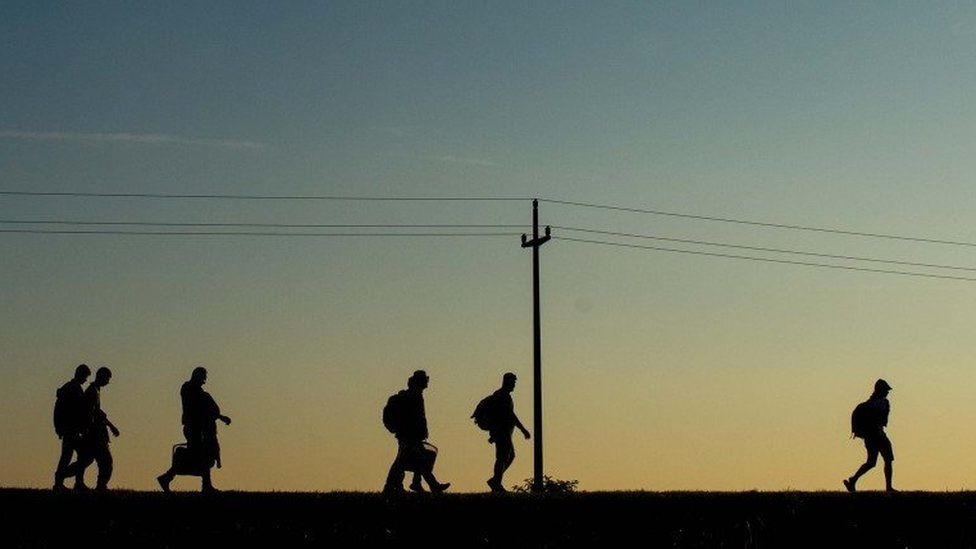
Find the location of a particular element. The width and height of the screenshot is (976, 549). box is located at coordinates (187, 459), (427, 456).